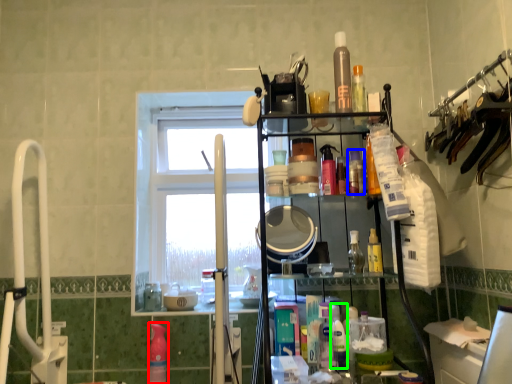
Question: Estimate the real-world distances between objects in this image. Which object is farther from cleaning product (highlighted by a red box), toiletry (highlighted by a blue box) or cleaning product (highlighted by a green box)?

Choices:
 (A) toiletry
 (B) cleaning product

Answer: (A)